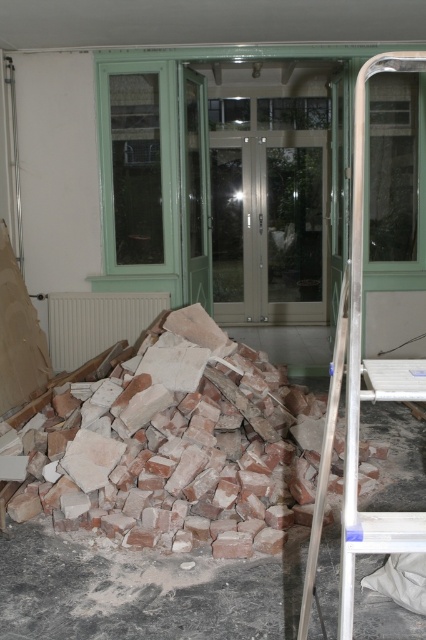
Question: Can you confirm if clear glass door at center is bigger than silver metallic ladder at right?

Choices:
 (A) no
 (B) yes

Answer: (B)

Question: Can you confirm if brick rubble at lower left is positioned below clear glass door at center?

Choices:
 (A) yes
 (B) no

Answer: (A)

Question: Estimate the real-world distances between objects in this image. Which object is farther from the brick rubble at lower left?

Choices:
 (A) clear glass door at center
 (B) silver metallic ladder at right

Answer: (A)

Question: Which point is closer to the camera?

Choices:
 (A) brick rubble at lower left
 (B) clear glass door at center

Answer: (A)

Question: Among these objects, which one is farthest from the camera?

Choices:
 (A) clear glass door at center
 (B) silver metallic ladder at right
 (C) brick rubble at lower left

Answer: (A)

Question: Can you confirm if brick rubble at lower left is positioned to the right of silver metallic ladder at right?

Choices:
 (A) no
 (B) yes

Answer: (A)